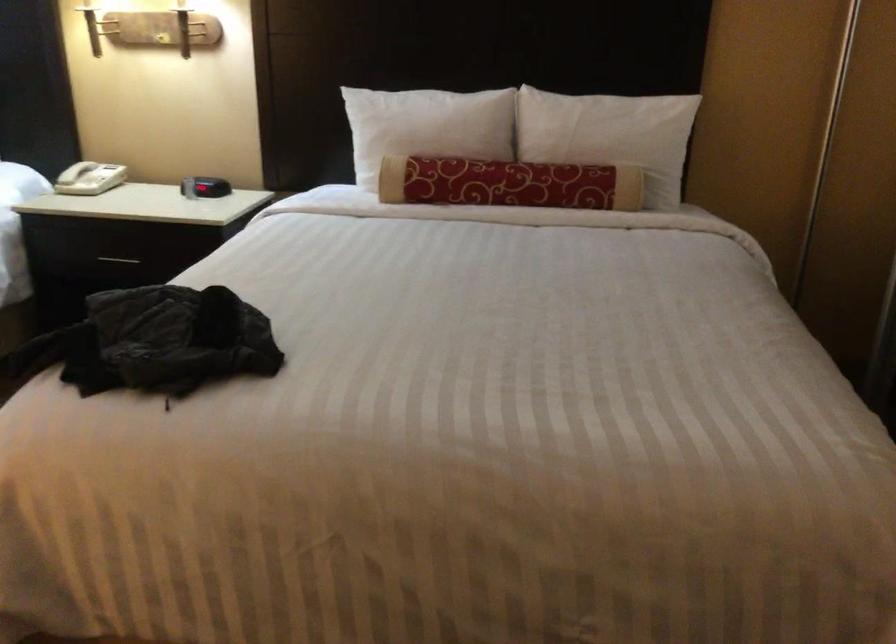
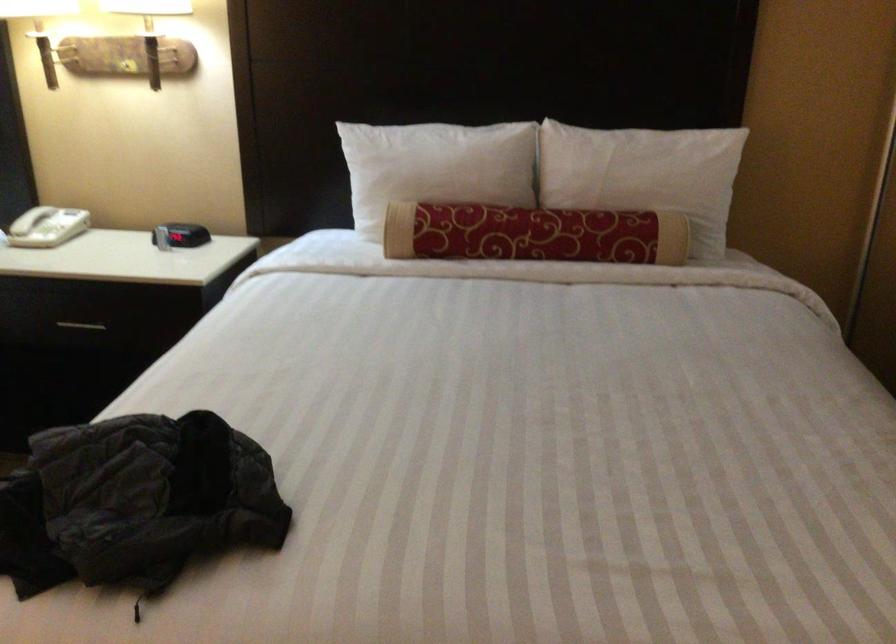
In the second image, find the point that corresponds to point (505, 182) in the first image.

(533, 234)